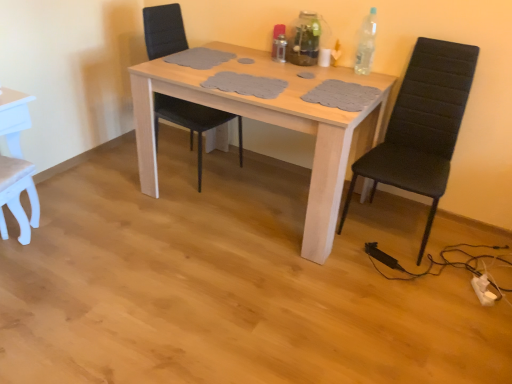
Question: Does white matte chair at lower left, which ranks as the first chair in left-to-right order, have a lesser width compared to black fabric chair at right, marked as the 3th chair in a left-to-right arrangement?

Choices:
 (A) no
 (B) yes

Answer: (B)

Question: Does white matte chair at lower left, which is the third chair in right-to-left order, have a greater height compared to black fabric chair at right, marked as the 3th chair in a left-to-right arrangement?

Choices:
 (A) yes
 (B) no

Answer: (B)

Question: Is the depth of white matte chair at lower left, which is the third chair in right-to-left order, greater than that of black fabric chair at right, marked as the 1th chair in a right-to-left arrangement?

Choices:
 (A) yes
 (B) no

Answer: (A)

Question: From the image's perspective, is white matte chair at lower left, which is the third chair in right-to-left order, located beneath black fabric chair at right, marked as the 1th chair in a right-to-left arrangement?

Choices:
 (A) yes
 (B) no

Answer: (A)

Question: Does white matte chair at lower left, which is the third chair in right-to-left order, turn towards black fabric chair at right, marked as the 3th chair in a left-to-right arrangement?

Choices:
 (A) yes
 (B) no

Answer: (B)

Question: Looking at the image, does transparent glass vase at upper center, arranged as the 2th bottle when viewed from the right, seem bigger or smaller compared to white matte chair at lower left, which ranks as the first chair in left-to-right order?

Choices:
 (A) small
 (B) big

Answer: (A)

Question: From the image's perspective, is transparent glass vase at upper center, arranged as the 2th bottle when viewed from the right, positioned above or below white matte chair at lower left, which ranks as the first chair in left-to-right order?

Choices:
 (A) below
 (B) above

Answer: (B)

Question: Looking at their shapes, would you say transparent glass vase at upper center, the 2th bottle in the left-to-right sequence, is wider or thinner than white matte chair at lower left, which ranks as the first chair in left-to-right order?

Choices:
 (A) thin
 (B) wide

Answer: (A)

Question: From a real-world perspective, is transparent glass vase at upper center, the 2th bottle in the left-to-right sequence, above or below white matte chair at lower left, which ranks as the first chair in left-to-right order?

Choices:
 (A) below
 (B) above

Answer: (B)

Question: Is point (19, 208) closer or farther from the camera than point (297, 29)?

Choices:
 (A) farther
 (B) closer

Answer: (B)

Question: Considering the positions of white matte chair at lower left, which is the third chair in right-to-left order, and transparent glass vase at upper center, the 2th bottle in the left-to-right sequence, in the image, is white matte chair at lower left, which is the third chair in right-to-left order, wider or thinner than transparent glass vase at upper center, the 2th bottle in the left-to-right sequence,?

Choices:
 (A) wide
 (B) thin

Answer: (A)

Question: Is white matte chair at lower left, which ranks as the first chair in left-to-right order, spatially inside transparent glass vase at upper center, the 2th bottle in the left-to-right sequence, or outside of it?

Choices:
 (A) outside
 (B) inside

Answer: (A)

Question: From a real-world perspective, is white matte chair at lower left, which is the third chair in right-to-left order, above or below transparent glass vase at upper center, the 2th bottle in the left-to-right sequence?

Choices:
 (A) above
 (B) below

Answer: (B)

Question: In the image, is light wood table at center on the left side or the right side of metallic silver bottle at upper center, the 1th bottle positioned from the left?

Choices:
 (A) right
 (B) left

Answer: (B)

Question: Is point (313, 206) positioned closer to the camera than point (272, 36)?

Choices:
 (A) farther
 (B) closer

Answer: (B)